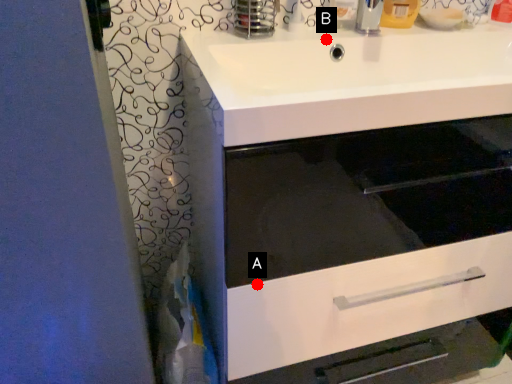
Question: Two points are circled on the image, labeled by A and B beside each circle. Which point is closer to the camera?

Choices:
 (A) A is closer
 (B) B is closer

Answer: (A)